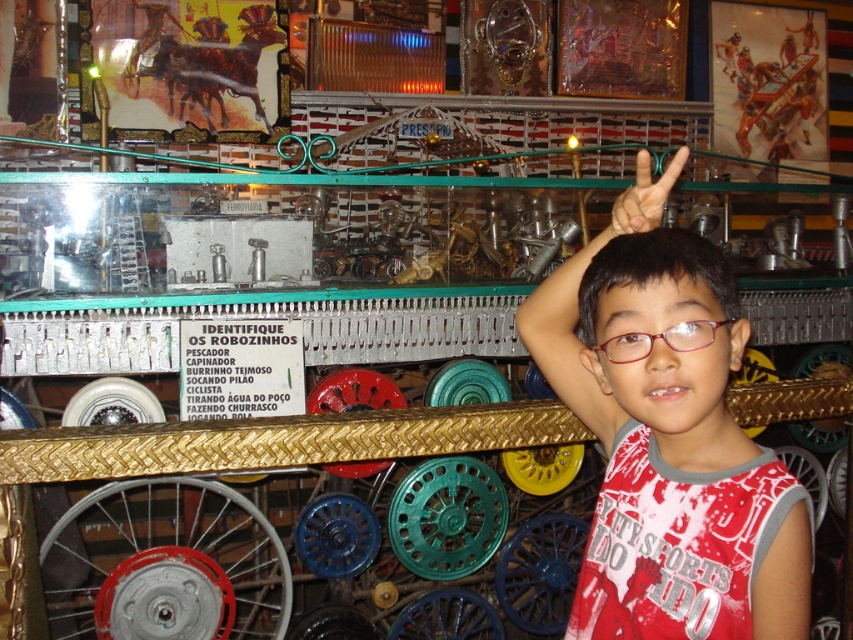
Between point (648, 179) and point (698, 332), which one is positioned behind?

The point (648, 179) is more distant.

In the scene shown: Between white matte hand at upper right and clear plastic glasses at upper right, which one appears on the right side from the viewer's perspective?

white matte hand at upper right

Which is behind, point (671, 172) or point (672, 336)?

Point (671, 172)

The image size is (853, 640). I want to click on white matte hand at upper right, so click(643, 195).

Can you confirm if white cotton shirt at upper right is bigger than white matte hand at upper right?

Correct, white cotton shirt at upper right is larger in size than white matte hand at upper right.

Based on the photo, how distant is white cotton shirt at upper right from white matte hand at upper right?

white cotton shirt at upper right is 34.43 centimeters from white matte hand at upper right.

Who is more distant from viewer, (724, 632) or (630, 186)?

The point (630, 186) is behind.

This screenshot has height=640, width=853. Find the location of `white cotton shirt at upper right`. white cotton shirt at upper right is located at coordinates (669, 445).

Is white cotton shirt at upper right to the left of clear plastic glasses at upper right from the viewer's perspective?

Correct, you'll find white cotton shirt at upper right to the left of clear plastic glasses at upper right.

Describe the element at coordinates (669, 445) in the screenshot. I see `white cotton shirt at upper right` at that location.

Between point (635, 445) and point (686, 326), which one is positioned in front?

Point (686, 326) is in front.

Find the location of a particular element. white cotton shirt at upper right is located at coordinates (669, 445).